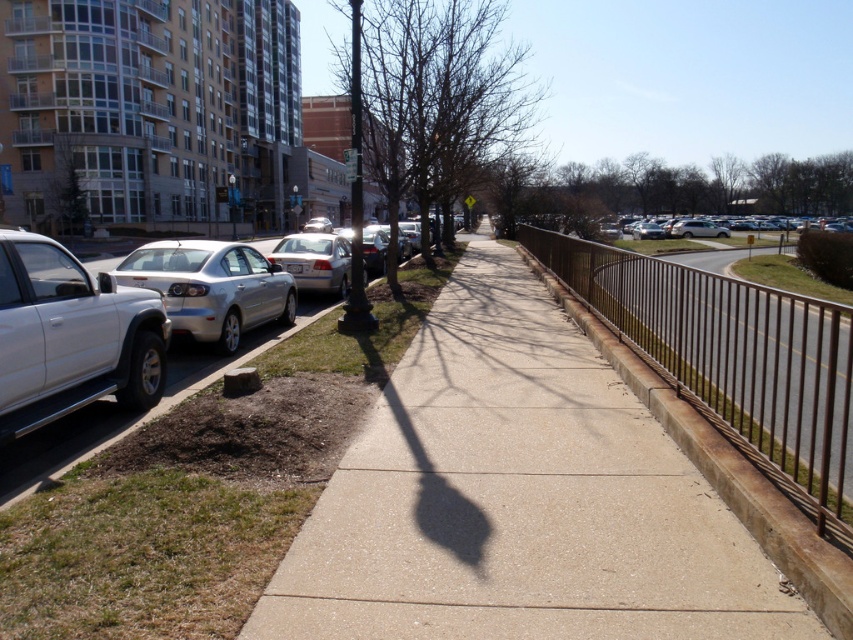
Between brown metal fence at right and satin silver sedan at center, which one appears on the right side from the viewer's perspective?

brown metal fence at right is more to the right.

Between point (840, 420) and point (312, 259), which one is positioned behind?

The point (312, 259) is behind.

Where is `brown metal fence at right`? The image size is (853, 640). brown metal fence at right is located at coordinates (732, 362).

Is point (680, 273) closer to camera compared to point (677, 230)?

Yes, point (680, 273) is in front of point (677, 230).

Does point (653, 339) come in front of point (711, 234)?

Yes.

Image resolution: width=853 pixels, height=640 pixels. Identify the location of brown metal fence at right. (732, 362).

Describe the element at coordinates (523, 496) in the screenshot. I see `concrete sidewalk at center` at that location.

Is point (451, 541) more distant than point (331, 266)?

No, it is in front of (331, 266).

Find the location of a particular element. The height and width of the screenshot is (640, 853). concrete sidewalk at center is located at coordinates (523, 496).